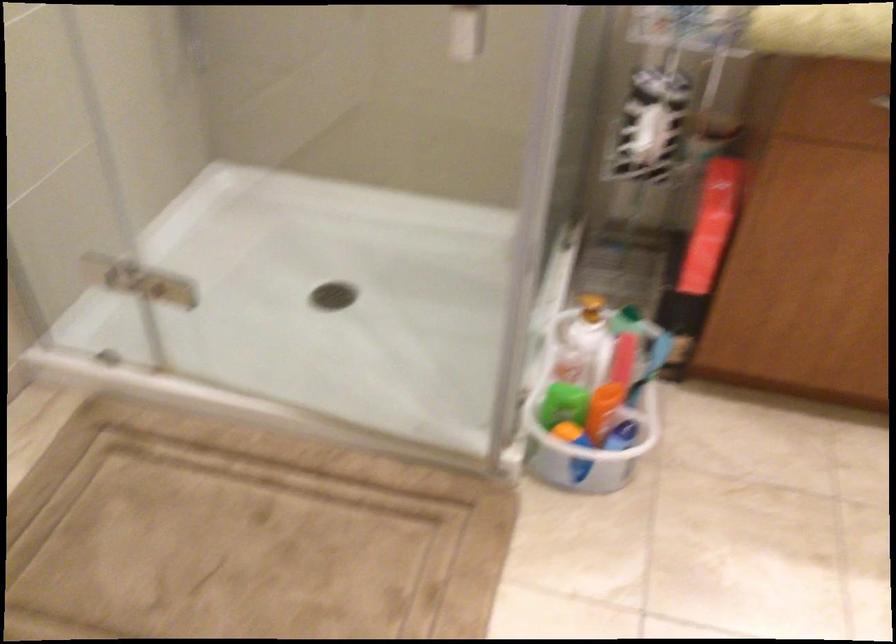
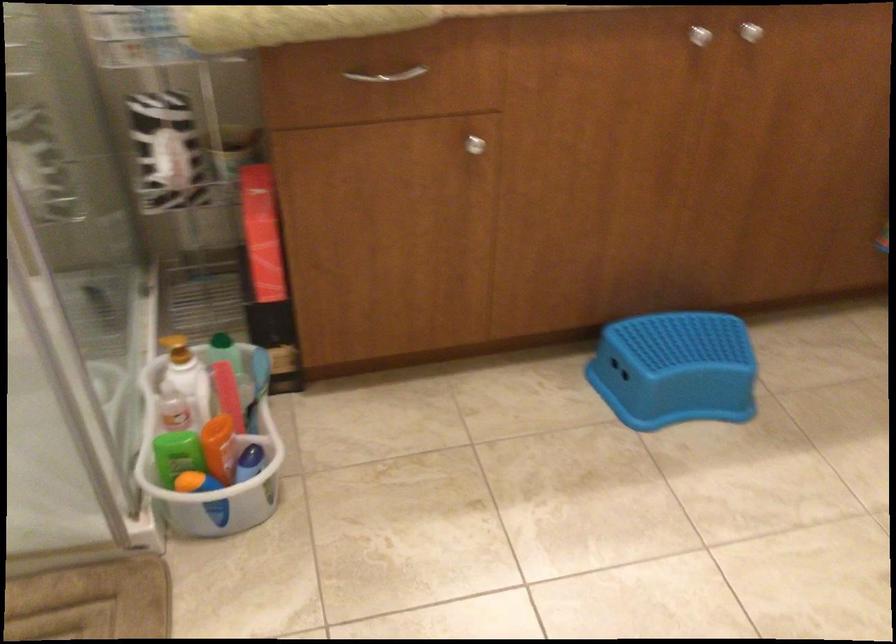
Locate, in the second image, the point that corresponds to (597,395) in the first image.

(208, 439)